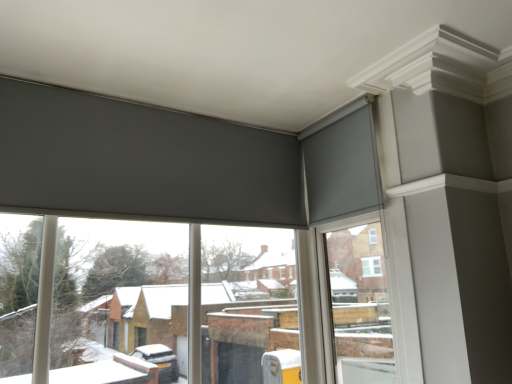
In order to face matte gray roller blinds at upper center, should I rotate leftwards or rightwards?

It's best to rotate left around 10.034 degrees.

This screenshot has height=384, width=512. In order to click on matte gray curtain at upper right in this screenshot , I will do `click(342, 168)`.

The image size is (512, 384). In order to click on matte gray roller blinds at upper center in this screenshot , I will do `click(93, 300)`.

Between matte gray roller blinds at upper center and matte gray curtain at upper right, which one has larger width?

With larger width is matte gray roller blinds at upper center.

From the image's perspective, who appears lower, matte gray roller blinds at upper center or matte gray curtain at upper right?

matte gray roller blinds at upper center appears lower in the image.

Find the location of `window on the left of matte gray curtain at upper right`. window on the left of matte gray curtain at upper right is located at coordinates pyautogui.click(x=93, y=300).

Based on the photo, from a real-world perspective, which is physically below, matte gray curtain at upper right or matte gray roller blinds at upper center?

From a 3D spatial view, matte gray roller blinds at upper center is below.

How different are the orientations of matte gray curtain at upper right and matte gray roller blinds at upper center in degrees?

They differ by 87.6 degrees in their facing directions.

Considering the relative positions of matte gray curtain at upper right and matte gray roller blinds at upper center in the image provided, is matte gray curtain at upper right in front of matte gray roller blinds at upper center?

No, matte gray curtain at upper right is further to the viewer.

Is matte gray curtain at upper right facing towards matte gray roller blinds at upper center?

Yes, matte gray curtain at upper right faces towards matte gray roller blinds at upper center.

From the image's perspective, relative to smooth white window frame at upper right, is matte gray curtain at upper right above or below?

Clearly, from the image's perspective, matte gray curtain at upper right is above smooth white window frame at upper right.

Is matte gray curtain at upper right to the right of smooth white window frame at upper right from the viewer's perspective?

Incorrect, matte gray curtain at upper right is not on the right side of smooth white window frame at upper right.

Considering the sizes of objects matte gray curtain at upper right and smooth white window frame at upper right in the image provided, who is shorter, matte gray curtain at upper right or smooth white window frame at upper right?

Standing shorter between the two is matte gray curtain at upper right.

Does matte gray curtain at upper right lie in front of smooth white window frame at upper right?

No, it is behind smooth white window frame at upper right.

Is smooth white window frame at upper right smaller than matte gray curtain at upper right?

Actually, smooth white window frame at upper right might be larger than matte gray curtain at upper right.

Can you tell me how much smooth white window frame at upper right and matte gray curtain at upper right differ in facing direction?

They differ by 1.49 degrees in their facing directions.

From a real-world perspective, relative to matte gray curtain at upper right, is smooth white window frame at upper right vertically above or below?

From a real-world perspective, smooth white window frame at upper right is physically below matte gray curtain at upper right.

Which object is thinner, matte gray roller blinds at upper center or smooth white window frame at upper right?

smooth white window frame at upper right.

Is point (170, 322) in front of point (373, 253)?

Yes, it is.

Looking at the image, does matte gray roller blinds at upper center seem bigger or smaller compared to smooth white window frame at upper right?

matte gray roller blinds at upper center is bigger than smooth white window frame at upper right.

How far apart are smooth white window frame at upper right and matte gray roller blinds at upper center?

A distance of 26.56 inches exists between smooth white window frame at upper right and matte gray roller blinds at upper center.

Is point (368, 325) farther from camera compared to point (45, 235)?

Yes, it is behind point (45, 235).

Based on the photo, considering the relative sizes of smooth white window frame at upper right and matte gray roller blinds at upper center in the image provided, is smooth white window frame at upper right taller than matte gray roller blinds at upper center?

Yes.

From the image's perspective, which is below, smooth white window frame at upper right or matte gray roller blinds at upper center?

From the image's view, matte gray roller blinds at upper center is below.

You are a GUI agent. You are given a task and a screenshot of the screen. Output one action in this format:
    pyautogui.click(x=<x>, y=<y>)
    Task: Click on the curtain above the matte gray roller blinds at upper center (from a real-world perspective)
    
    Given the screenshot: What is the action you would take?
    pyautogui.click(x=342, y=168)

At what (x,y) coordinates should I click in order to perform the action: click on window on the left of the matte gray curtain at upper right. Please return your answer as a coordinate pair (x, y). This screenshot has height=384, width=512. Looking at the image, I should click on (93, 300).

From the image, which object appears to be farther from matte gray curtain at upper right, smooth white window frame at upper right or matte gray roller blinds at upper center?

Among the two, matte gray roller blinds at upper center is located further to matte gray curtain at upper right.

Looking at the image, which one is located further to matte gray roller blinds at upper center, smooth white window frame at upper right or matte gray curtain at upper right?

Based on the image, matte gray curtain at upper right appears to be further to matte gray roller blinds at upper center.

Estimate the real-world distances between objects in this image. Which object is further from matte gray curtain at upper right, matte gray roller blinds at upper center or smooth white window frame at upper right?

The object further to matte gray curtain at upper right is matte gray roller blinds at upper center.

When comparing their distances from matte gray roller blinds at upper center, does matte gray curtain at upper right or smooth white window frame at upper right seem further?

Among the two, matte gray curtain at upper right is located further to matte gray roller blinds at upper center.

When comparing their distances from smooth white window frame at upper right, does matte gray roller blinds at upper center or matte gray curtain at upper right seem closer?

matte gray curtain at upper right is closer to smooth white window frame at upper right.

Estimate the real-world distances between objects in this image. Which object is closer to smooth white window frame at upper right, matte gray curtain at upper right or matte gray roller blinds at upper center?

matte gray curtain at upper right is closer to smooth white window frame at upper right.

The width and height of the screenshot is (512, 384). What are the coordinates of `curtain between matte gray roller blinds at upper center and smooth white window frame at upper right from left to right` in the screenshot? It's located at (342, 168).